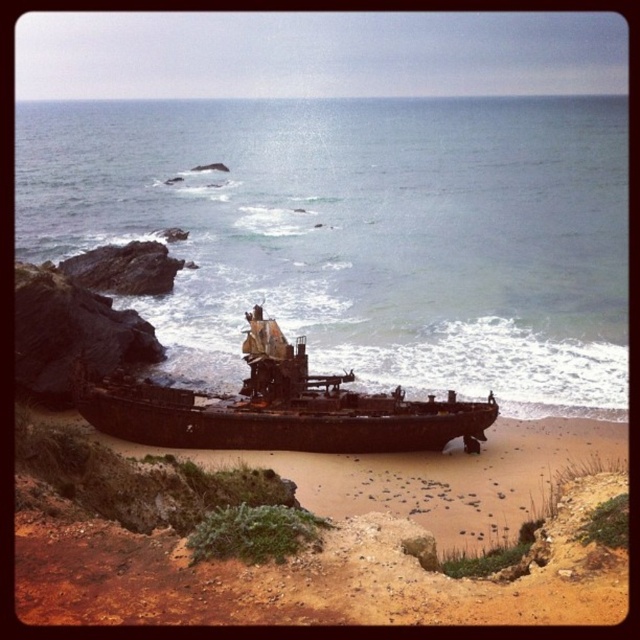
Question: Which object is farther from the camera taking this photo?

Choices:
 (A) clear blue water at lower center
 (B) rusty metal pirate ship at center

Answer: (A)

Question: Is clear blue water at lower center below rusty metal pirate ship at center?

Choices:
 (A) yes
 (B) no

Answer: (B)

Question: Is clear blue water at lower center to the right of rusty metal pirate ship at center from the viewer's perspective?

Choices:
 (A) yes
 (B) no

Answer: (B)

Question: Is clear blue water at lower center thinner than rusty metal pirate ship at center?

Choices:
 (A) no
 (B) yes

Answer: (A)

Question: Which point appears farthest from the camera in this image?

Choices:
 (A) (81, 244)
 (B) (177, 401)

Answer: (A)